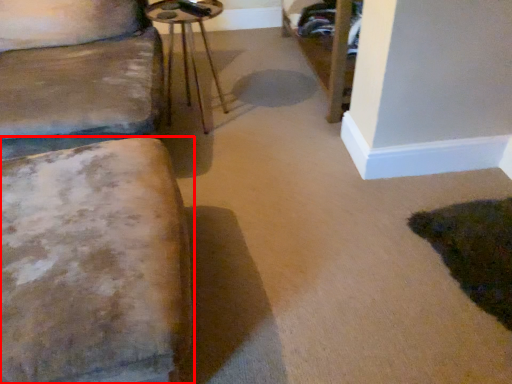
Question: In this image, where is furniture (annotated by the red box) located relative to side table?

Choices:
 (A) left
 (B) right

Answer: (A)